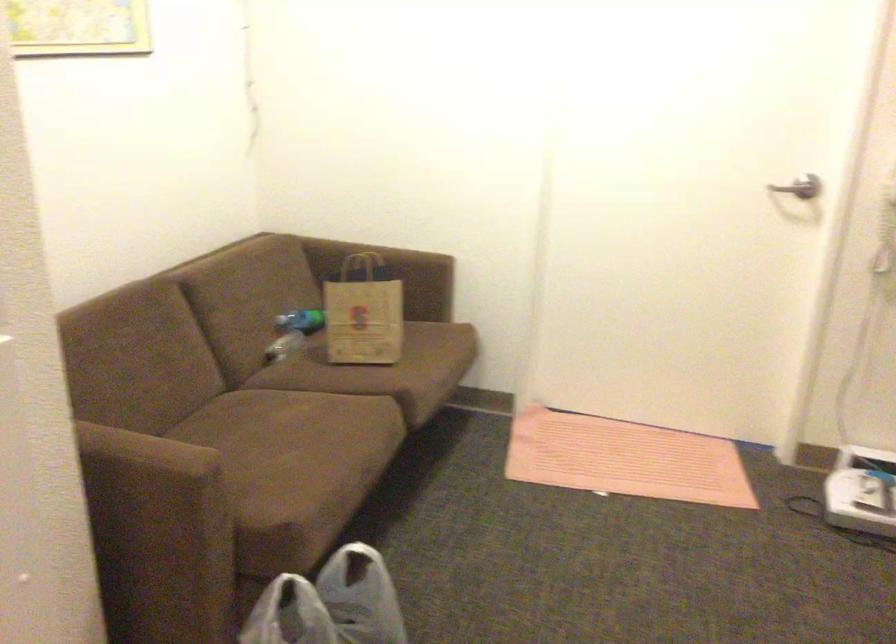
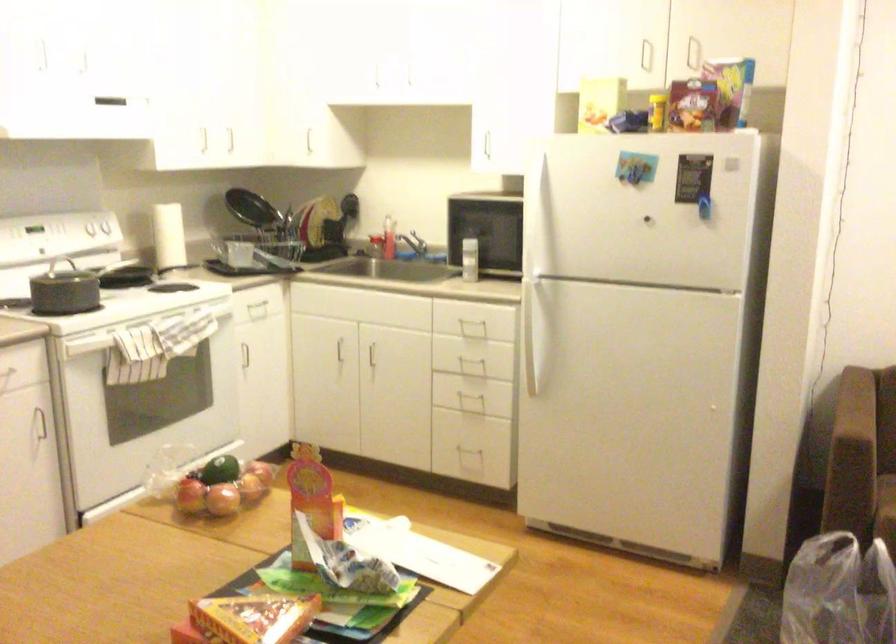
Find the pixel in the second image that matches [202,476] in the first image.

(879, 446)